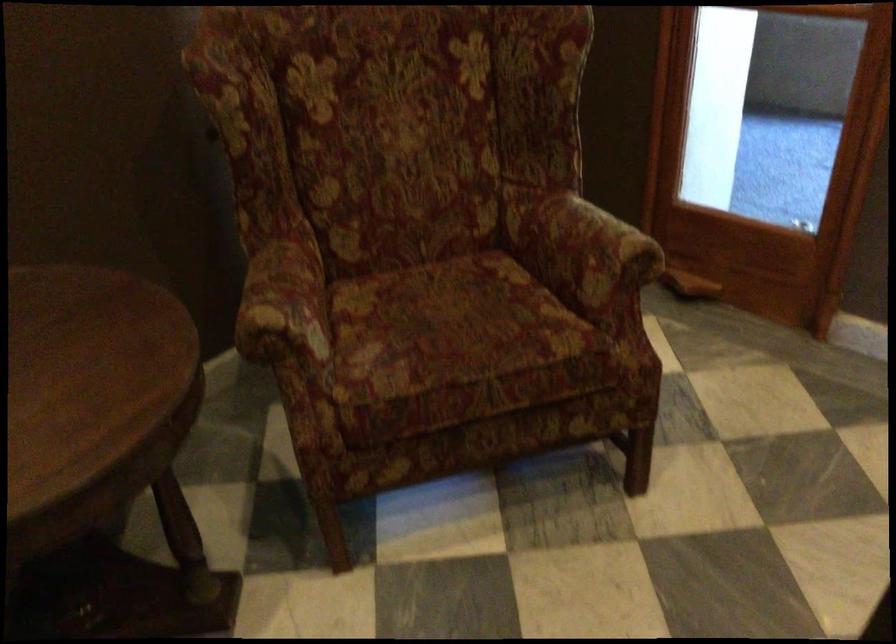
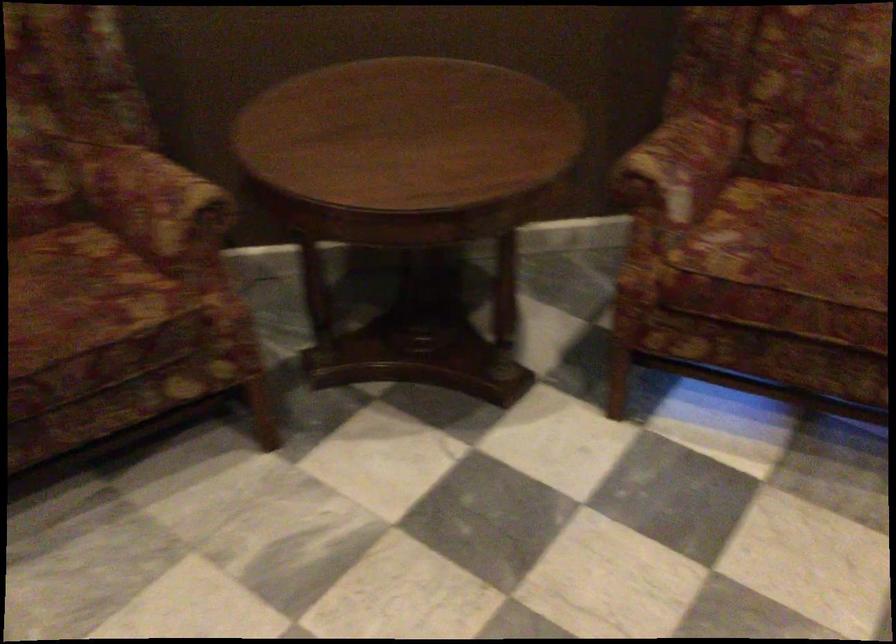
Where in the second image is the point corresponding to (436,328) from the first image?

(794, 243)